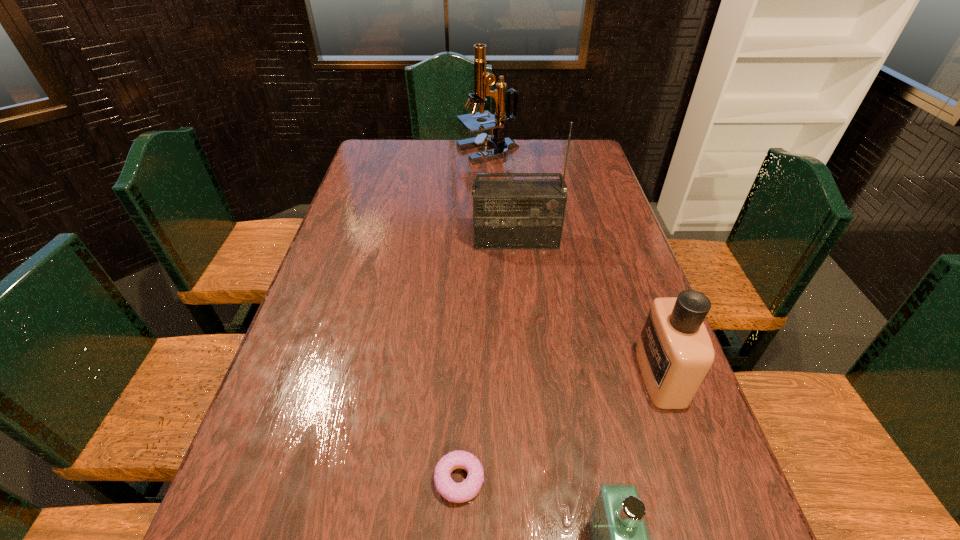
The width and height of the screenshot is (960, 540). I want to click on blank region between the second farthest object and the shortest object, so click(488, 360).

This screenshot has width=960, height=540. Identify the location of free spot between the doughnut and the radio receiver. click(488, 360).

Locate an element on the screen. The image size is (960, 540). empty space that is in between the rightmost object and the microscope is located at coordinates [574, 264].

The image size is (960, 540). Identify the location of vacant area that lies between the radio receiver and the shortest object. click(488, 360).

You are a GUI agent. You are given a task and a screenshot of the screen. Output one action in this format:
    pyautogui.click(x=<x>, y=<y>)
    Task: Click on the unoccupied position between the farthest object and the shortest object
    
    Given the screenshot: What is the action you would take?
    pyautogui.click(x=473, y=316)

This screenshot has height=540, width=960. What are the coordinates of `object that is the third nearest to the second farthest object` in the screenshot? It's located at (464, 491).

Locate an element on the screen. object that can be found as the closest to the farthest object is located at coordinates (507, 214).